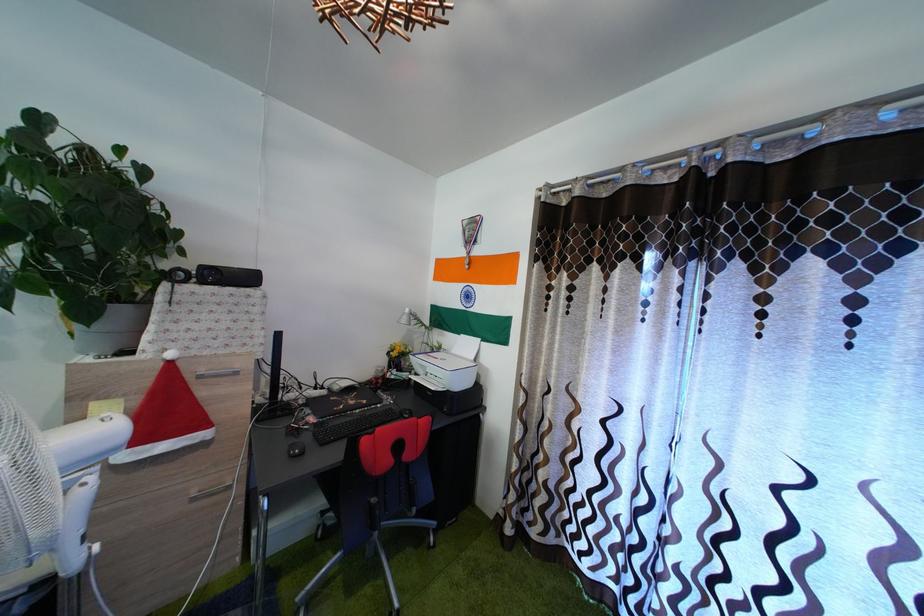
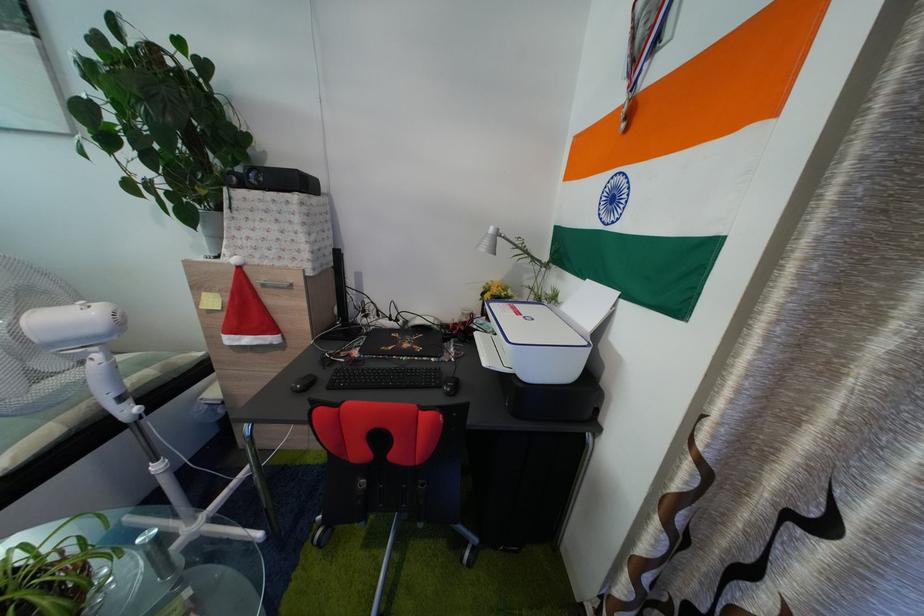
Question: How did the camera likely rotate?

Choices:
 (A) Left
 (B) Right
 (C) Up
 (D) Down

Answer: (A)